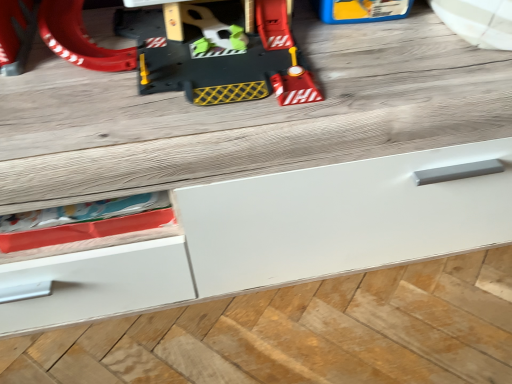
This screenshot has width=512, height=384. I want to click on plastic toy train at upper center, so click(188, 61).

What do you see at coordinates (188, 61) in the screenshot?
I see `plastic toy train at upper center` at bounding box center [188, 61].

What are the coordinates of `plastic toy train at upper center` in the screenshot? It's located at (188, 61).